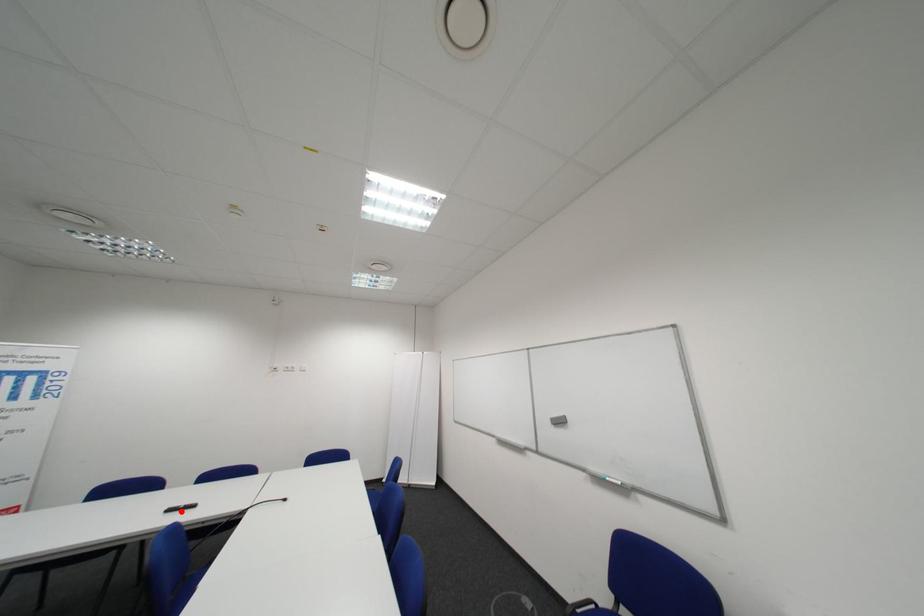
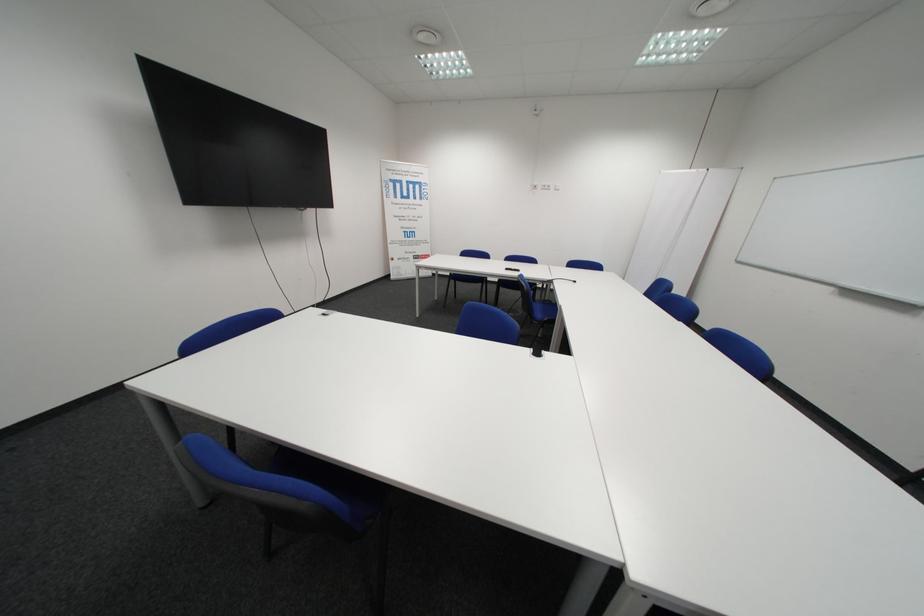
Question: I am providing you with two images of the same scene from different viewpoints. Given a red point in image1, look at the same physical point in image2. Is it:

Choices:
 (A) Closer to the viewpoint
 (B) Farther from the viewpoint

Answer: (A)